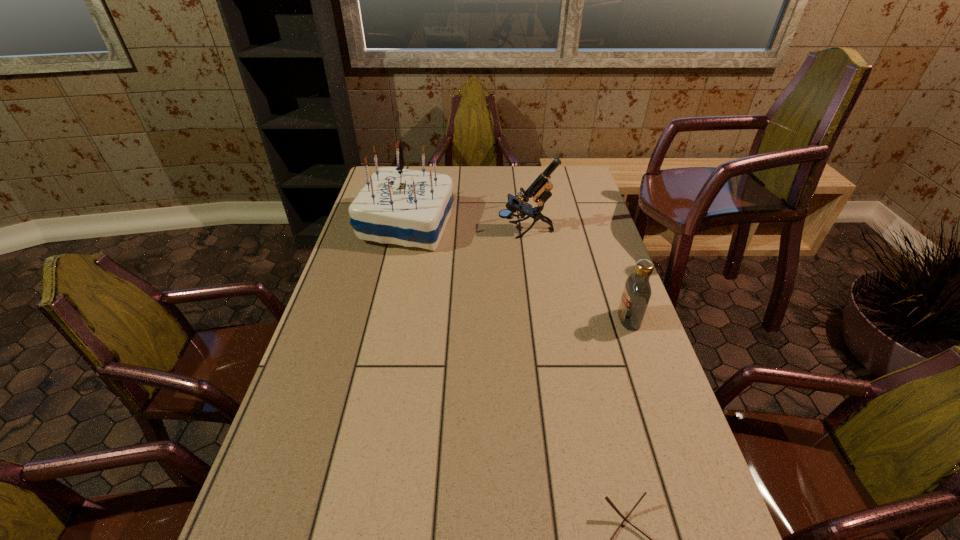
The image size is (960, 540). Identify the location of microscope. (540, 189).

Find the location of a particular element. This screenshot has height=540, width=960. birthday cake is located at coordinates (x=411, y=208).

What are the coordinates of `the third farthest object` in the screenshot? It's located at (636, 295).

You are a GUI agent. You are given a task and a screenshot of the screen. Output one action in this format:
    pyautogui.click(x=<x>, y=<y>)
    Task: Click on the vodka
    This screenshot has height=540, width=960.
    Given the screenshot: What is the action you would take?
    pyautogui.click(x=636, y=295)

What are the coordinates of `vacant space located through the eyepiece of the microscope` in the screenshot? It's located at (473, 230).

I want to click on free region located 0.360m through the eyepiece of the microscope, so click(x=399, y=230).

You are a GUI agent. You are given a task and a screenshot of the screen. Output one action in this format:
    pyautogui.click(x=<x>, y=<y>)
    Task: Click on the free spot located 0.070m through the eyepiece of the microscope
    This screenshot has height=540, width=960.
    Given the screenshot: What is the action you would take?
    pyautogui.click(x=479, y=230)

This screenshot has width=960, height=540. What are the coordinates of `free point located 0.230m on the back of the leftmost object` in the screenshot? It's located at (419, 172).

Identify the location of free space located 0.280m on the front-facing side of the second shortest object. The image size is (960, 540). (522, 319).

I want to click on free location located 0.270m on the front-facing side of the second shortest object, so 525,319.